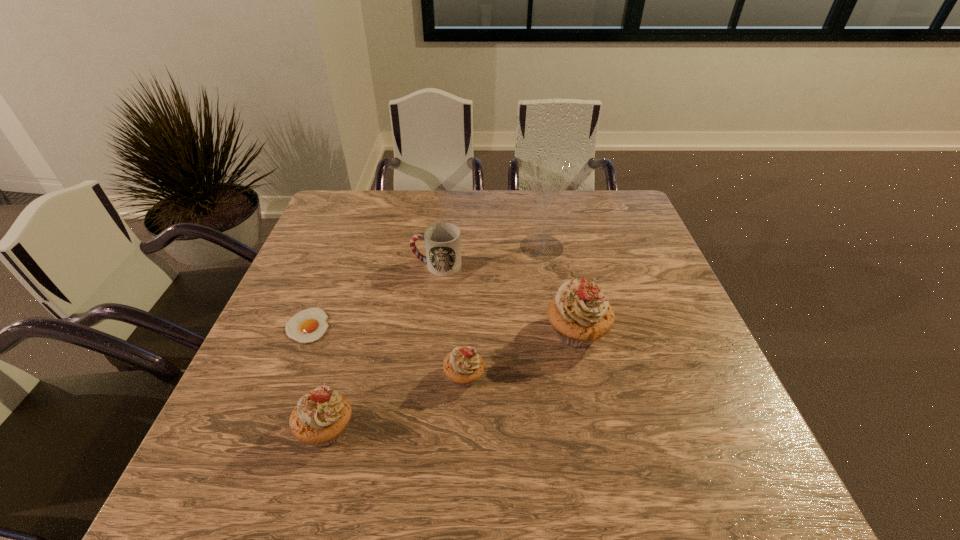
You are a GUI agent. You are given a task and a screenshot of the screen. Output one action in this format:
    pyautogui.click(x=<x>, y=<y>)
    Task: Click on the empty space between the egg yolk and the nearest object
    
    Given the screenshot: What is the action you would take?
    pyautogui.click(x=317, y=377)

You are a GUI agent. You are given a task and a screenshot of the screen. Output one action in this format:
    pyautogui.click(x=<x>, y=<y>)
    Task: Click on the free area in between the leftmost cupcake and the leftmost object
    The width and height of the screenshot is (960, 540).
    Given the screenshot: What is the action you would take?
    pyautogui.click(x=317, y=377)

What are the coordinates of `free space that is in between the fifth object from right to left and the leftmost object` in the screenshot? It's located at (317, 377).

I want to click on vacant area that lies between the egg yolk and the nearest cupcake, so tap(317, 377).

Find the location of a particular element. vacant space that is in between the second cupcake from right to left and the cup is located at coordinates (450, 321).

Find the location of a particular element. This screenshot has width=960, height=540. vacant space that is in between the fifth object from right to left and the cup is located at coordinates (382, 347).

The image size is (960, 540). What are the coordinates of `the closest object to the second cupcake from left to right` in the screenshot? It's located at (580, 314).

Where is `the second closest object to the cup`? The height and width of the screenshot is (540, 960). the second closest object to the cup is located at coordinates (309, 325).

Where is `the second closest cupcake to the cup`? This screenshot has width=960, height=540. the second closest cupcake to the cup is located at coordinates (463, 366).

The width and height of the screenshot is (960, 540). In order to click on cupcake that is the third nearest to the cup in this screenshot , I will do `click(320, 417)`.